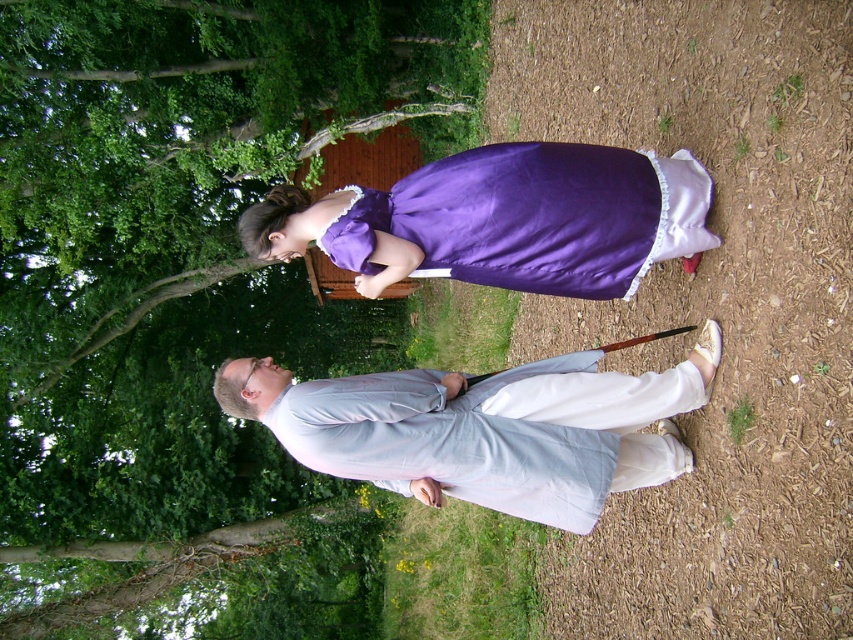
Is light gray fabric robe at center further to camera compared to purple satin dress at center?

No, light gray fabric robe at center is closer to the viewer.

Does light gray fabric robe at center appear on the right side of purple satin dress at center?

In fact, light gray fabric robe at center is to the left of purple satin dress at center.

Does point (473, 426) come in front of point (405, 221)?

That is True.

Where is `light gray fabric robe at center`? light gray fabric robe at center is located at coordinates (486, 428).

Based on the photo, is green leafy tree at upper center bigger than light gray fabric robe at center?

Incorrect, green leafy tree at upper center is not larger than light gray fabric robe at center.

Does green leafy tree at upper center appear on the right side of light gray fabric robe at center?

No, green leafy tree at upper center is not to the right of light gray fabric robe at center.

Does point (38, 394) come behind point (488, 458)?

Yes, it is.

This screenshot has width=853, height=640. Find the location of `green leafy tree at upper center`. green leafy tree at upper center is located at coordinates (180, 236).

Which of these two, green leafy tree at upper center or purple satin dress at center, stands shorter?

green leafy tree at upper center

Which is in front, point (82, 296) or point (492, 172)?

Point (492, 172)

Where is `green leafy tree at upper center`? green leafy tree at upper center is located at coordinates (180, 236).